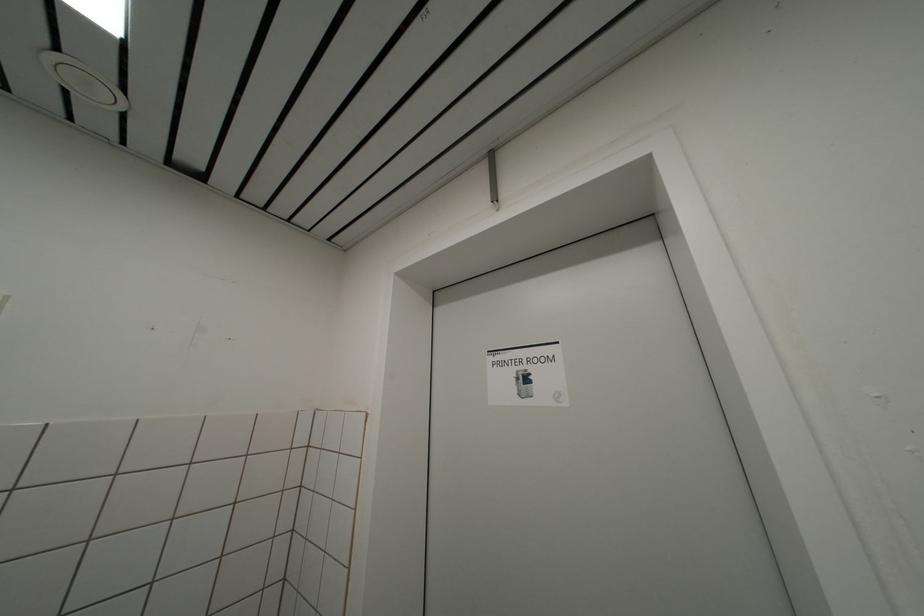
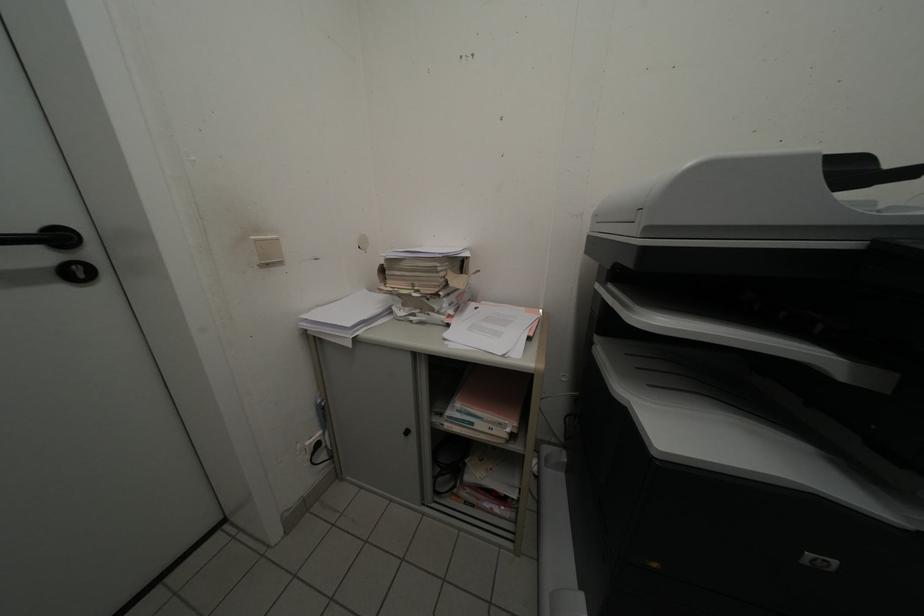
Question: The camera is either moving clockwise (left) or counter-clockwise (right) around the object. The first image is from the beginning of the video and the second image is from the end. Is the camera moving left or right when shooting the video?

Choices:
 (A) Left
 (B) Right

Answer: (A)